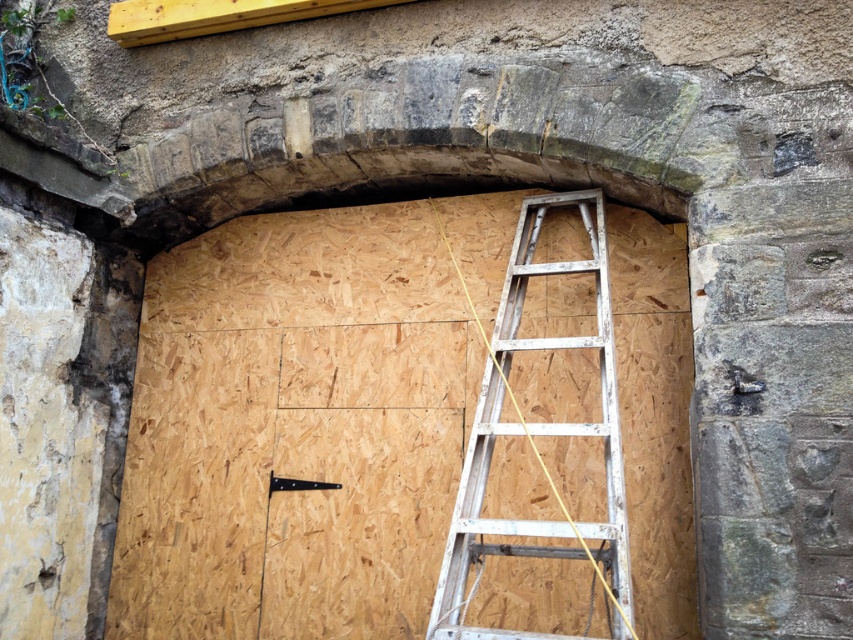
Does white aluminum ladder at center have a smaller size compared to black metal hinge at center?

No, white aluminum ladder at center is not smaller than black metal hinge at center.

Measure the distance from white aluminum ladder at center to black metal hinge at center.

The distance of white aluminum ladder at center from black metal hinge at center is 1.02 meters.

Is point (494, 419) closer to viewer compared to point (338, 486)?

That is True.

You are a GUI agent. You are given a task and a screenshot of the screen. Output one action in this format:
    pyautogui.click(x=<x>, y=<y>)
    Task: Click on the white aluminum ladder at center
    The height and width of the screenshot is (640, 853).
    Given the screenshot: What is the action you would take?
    pyautogui.click(x=537, y=433)